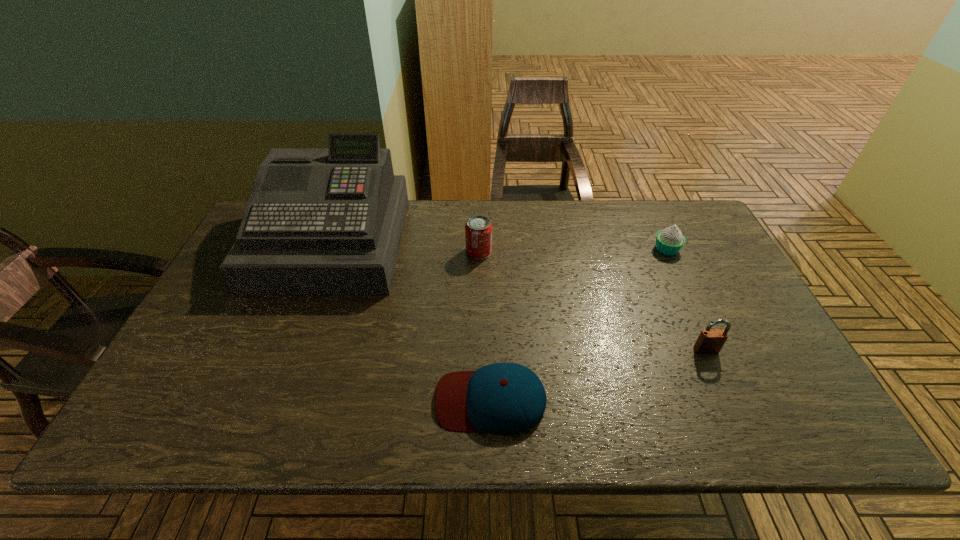
This screenshot has width=960, height=540. Identify the location of cupcake that is at the right edge. [x=669, y=241].

In order to click on object that is at the far left corner in this screenshot , I will do `click(329, 221)`.

At what (x,y) coordinates should I click in order to perform the action: click on object positioned at the far right corner. Please return your answer as a coordinate pair (x, y). Looking at the image, I should click on (669, 241).

The height and width of the screenshot is (540, 960). I want to click on free spot at the far edge of the desktop, so click(x=566, y=215).

At what (x,y) coordinates should I click in order to perform the action: click on blank space at the near edge. Please return your answer as a coordinate pair (x, y). This screenshot has width=960, height=540. Looking at the image, I should click on (649, 418).

In order to click on vacant space at the left edge of the desktop in this screenshot , I will do tap(212, 352).

You are a GUI agent. You are given a task and a screenshot of the screen. Output one action in this format:
    pyautogui.click(x=<x>, y=<y>)
    Task: Click on the vacant position at the right edge of the desktop
    
    Given the screenshot: What is the action you would take?
    pyautogui.click(x=781, y=379)

Locate an element on the screen. The image size is (960, 540). vacant space at the far right corner of the desktop is located at coordinates (685, 218).

Locate an element on the screen. The image size is (960, 540). free point between the can and the tallest object is located at coordinates pyautogui.click(x=405, y=247).

You are a GUI agent. You are given a task and a screenshot of the screen. Output one action in this format:
    pyautogui.click(x=<x>, y=<y>)
    Task: Click on the vacant area between the cupcake and the can
    
    Given the screenshot: What is the action you would take?
    pos(572,251)